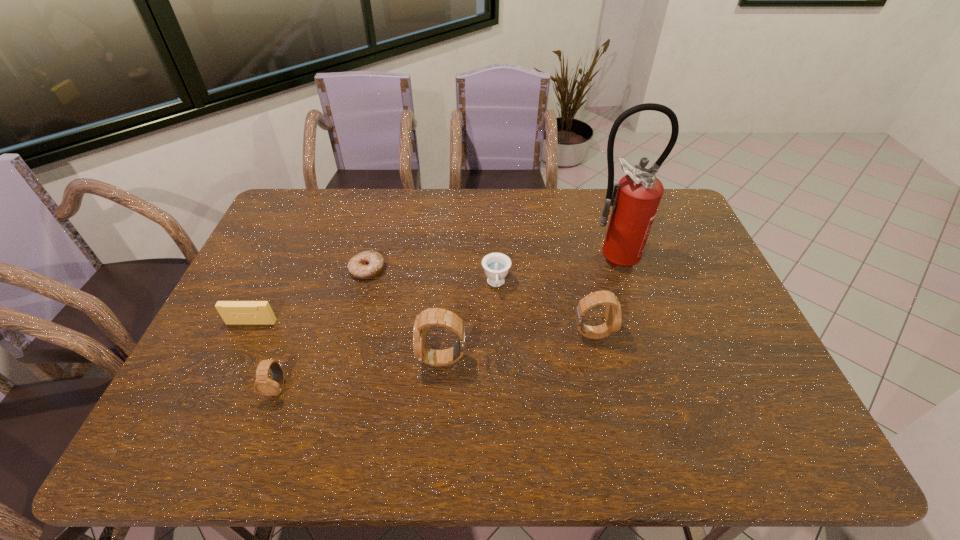
Find the location of a particular element. the fourth tallest object is located at coordinates (263, 385).

The height and width of the screenshot is (540, 960). Identify the location of the leftmost watch. (263, 385).

The width and height of the screenshot is (960, 540). I want to click on the fourth object from right to left, so click(x=441, y=317).

Where is `the second tallest watch`? Image resolution: width=960 pixels, height=540 pixels. the second tallest watch is located at coordinates (613, 316).

Locate an element on the screen. This screenshot has height=540, width=960. the rightmost watch is located at coordinates (613, 316).

Identify the location of doughnut. (367, 264).

Locate an element on the screen. the shortest object is located at coordinates (367, 264).

What are the coordinates of `the fifth object from left to right` in the screenshot? It's located at (496, 265).

Where is `the leftmost object`? the leftmost object is located at coordinates (232, 312).

The height and width of the screenshot is (540, 960). I want to click on the tallest object, so click(635, 200).